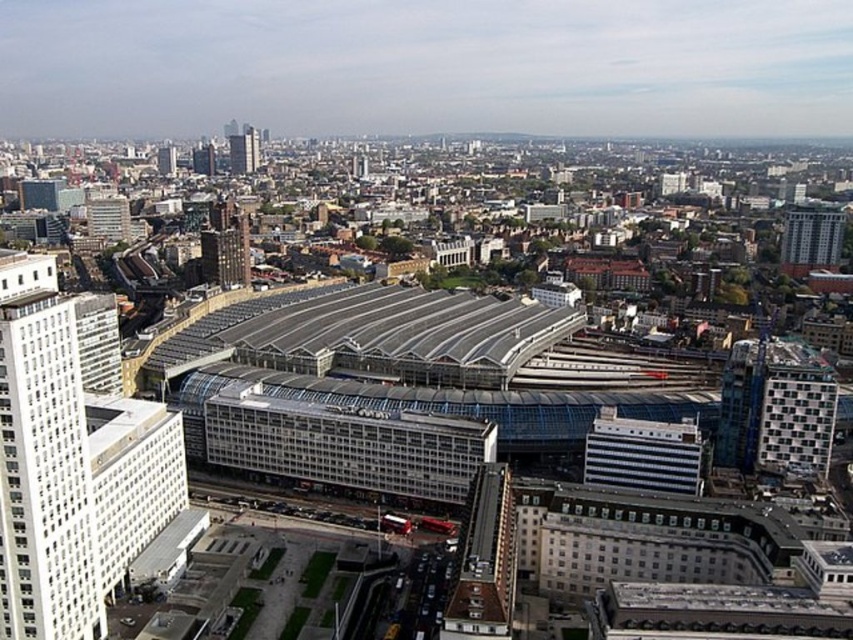
From the picture: Who is taller, dark gray concrete building at center-left or white glass building at upper left?

dark gray concrete building at center-left

Locate an element on the screen. The image size is (853, 640). dark gray concrete building at center-left is located at coordinates (225, 244).

Who is positioned more to the left, white glass building at center-right or white glass building at upper left?

Positioned to the left is white glass building at upper left.

Who is higher up, white glass building at center-right or white glass building at upper left?

Positioned higher is white glass building at upper left.

Who is more forward, (635, 449) or (90, 228)?

Point (635, 449)

Where is `white glass building at center-right`? The width and height of the screenshot is (853, 640). white glass building at center-right is located at coordinates (643, 452).

Does metallic silver tower at center come in front of white glass building at upper left?

Yes, metallic silver tower at center is closer to the viewer.

What do you see at coordinates (485, 561) in the screenshot?
I see `metallic silver tower at center` at bounding box center [485, 561].

Is point (497, 531) farther from viewer compared to point (120, 196)?

That is False.

Where is `metallic silver tower at center`? metallic silver tower at center is located at coordinates (485, 561).